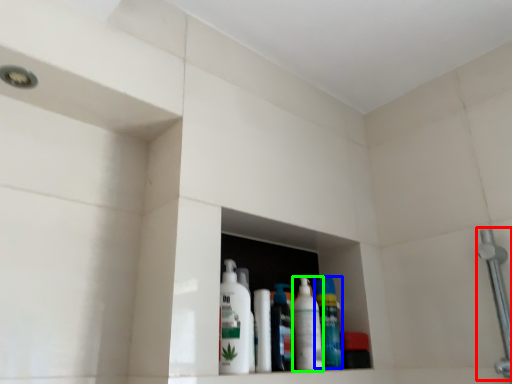
Question: Which is farther away from shower (highlighted by a red box)? cleaning product (highlighted by a blue box) or cleaning product (highlighted by a green box)?

Choices:
 (A) cleaning product
 (B) cleaning product

Answer: (B)